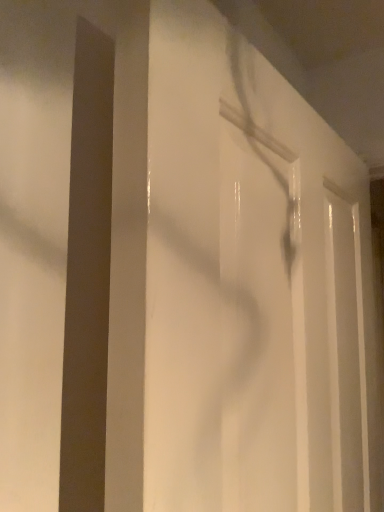
Locate an element on the screen. The height and width of the screenshot is (512, 384). white glossy door at center is located at coordinates (319, 283).

What do you see at coordinates (319, 283) in the screenshot?
I see `white glossy door at center` at bounding box center [319, 283].

What is the approximate height of white glossy door at center?

33.19 inches.

This screenshot has height=512, width=384. What are the coordinates of `white glossy door at center` in the screenshot? It's located at (319, 283).